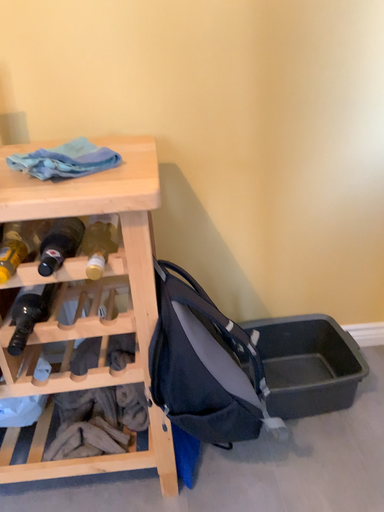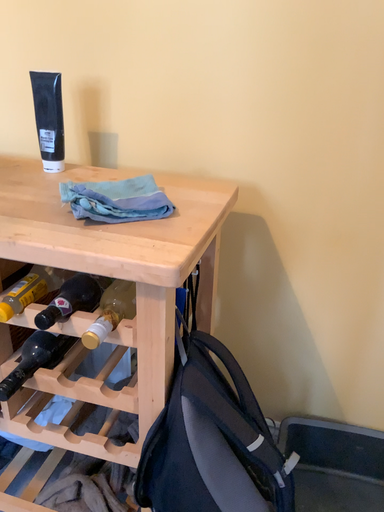
Question: How did the camera likely rotate when shooting the video?

Choices:
 (A) rotated right
 (B) rotated left

Answer: (B)